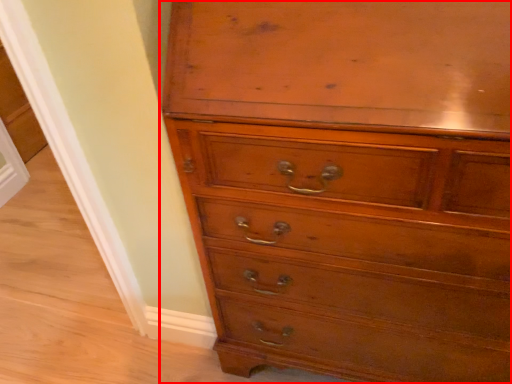
Question: Where is chest of drawers (annotated by the red box) located in relation to screen door in the image?

Choices:
 (A) right
 (B) left

Answer: (A)